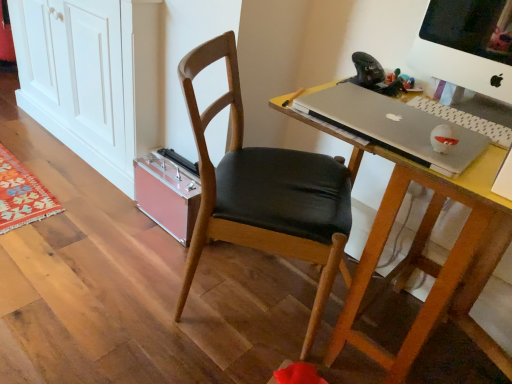
Where is `blank space to the left of wooden chair at center`? blank space to the left of wooden chair at center is located at coordinates (116, 288).